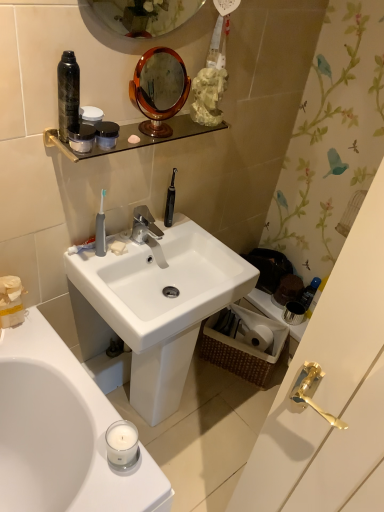
Measure the distance between black matte spray can at upper left and camera.

black matte spray can at upper left and camera are 3.39 feet apart.

Identify the location of matte black jar at upper center, the first mouthwash from the top. This screenshot has width=384, height=512. (106, 134).

You are a GUI agent. You are given a task and a screenshot of the screen. Output one action in this format:
    pyautogui.click(x=<x>, y=<y>)
    Task: Click on the silver metallic faucet at center
    
    Given the screenshot: What is the action you would take?
    pyautogui.click(x=144, y=225)

The height and width of the screenshot is (512, 384). Identify the location of shiny brown mirror at upper center. (159, 89).

Identify the location of black matte spray can at upper left. This screenshot has height=512, width=384. (68, 94).

From the image's perspective, between shiny brown mirror at upper center and white glossy sink at center, who is located below?

white glossy sink at center is shown below in the image.

Can you see shiny brown mirror at upper center touching white glossy sink at center?

shiny brown mirror at upper center and white glossy sink at center are clearly separated.

In the scene shown: Does shiny brown mirror at upper center come in front of white glossy sink at center?

That is True.

Could you tell me if silver metallic faucet at center is facing blue glossy bottle at right, placed as the third mouthwash when sorted from top to bottom?

No.

From the image's perspective, between silver metallic faucet at center and blue glossy bottle at right, placed as the third mouthwash when sorted from top to bottom, which one is located above?

silver metallic faucet at center is shown above in the image.

Which object is positioned more to the right, silver metallic faucet at center or blue glossy bottle at right, marked as the 1th mouthwash in a back-to-front arrangement?

blue glossy bottle at right, marked as the 1th mouthwash in a back-to-front arrangement.

Which is behind, point (134, 229) or point (305, 298)?

The point (305, 298) is farther from the camera.

Considering the positions of objects woven brown picnic basket at lower right and silver metallic faucet at center in the image provided, who is more to the left, woven brown picnic basket at lower right or silver metallic faucet at center?

Positioned to the left is silver metallic faucet at center.

Consider the image. Is woven brown picnic basket at lower right directly adjacent to silver metallic faucet at center?

There is a gap between woven brown picnic basket at lower right and silver metallic faucet at center.

Based on the photo, is woven brown picnic basket at lower right not inside silver metallic faucet at center?

Yes, woven brown picnic basket at lower right is located beyond the bounds of silver metallic faucet at center.

Can you tell me how much woven brown picnic basket at lower right and silver metallic faucet at center differ in facing direction?

woven brown picnic basket at lower right and silver metallic faucet at center are facing 65.9 degrees away from each other.

From the image's perspective, relative to matte black jar at upper center, which is the first mouthwash from front to back, is white matte toilet paper at lower right above or below?

Clearly, from the image's perspective, white matte toilet paper at lower right is below matte black jar at upper center, which is the first mouthwash from front to back.

From the picture: Is the position of white matte toilet paper at lower right more distant than that of matte black jar at upper center, arranged as the 2th mouthwash when ordered from the bottom?

Yes, white matte toilet paper at lower right is behind matte black jar at upper center, arranged as the 2th mouthwash when ordered from the bottom.

Is white matte toilet paper at lower right oriented towards matte black jar at upper center, which appears as the second mouthwash when viewed from the top?

No, white matte toilet paper at lower right is not aimed at matte black jar at upper center, which appears as the second mouthwash when viewed from the top.

Which mouthwash is the 2nd one when counting from the front of the white matte toilet paper at lower right? Please provide its 2D coordinates.

[(81, 137)]

Which is in front, black matte spray can at upper left or matte black jar at upper center, which appears as the second mouthwash when viewed from the top?

black matte spray can at upper left is in front.

Could you measure the distance between black matte spray can at upper left and matte black jar at upper center, which is the first mouthwash from front to back?

black matte spray can at upper left and matte black jar at upper center, which is the first mouthwash from front to back, are 2.51 inches apart from each other.

Considering the sizes of objects black matte spray can at upper left and matte black jar at upper center, which ranks as the 3th mouthwash in right-to-left order, in the image provided, who is taller, black matte spray can at upper left or matte black jar at upper center, which ranks as the 3th mouthwash in right-to-left order,?

black matte spray can at upper left.

Considering the relative positions of black matte spray can at upper left and matte black jar at upper center, which appears as the second mouthwash when viewed from the top, in the image provided, is black matte spray can at upper left to the left of matte black jar at upper center, which appears as the second mouthwash when viewed from the top, from the viewer's perspective?

Yes, black matte spray can at upper left is to the left of matte black jar at upper center, which appears as the second mouthwash when viewed from the top.

Is woven brown picnic basket at lower right in contact with shiny brown mirror at upper center?

No, woven brown picnic basket at lower right is not with shiny brown mirror at upper center.

Which is nearer, [229,366] or [170,134]?

Point [229,366] is farther from the camera than point [170,134].

From a real-world perspective, is woven brown picnic basket at lower right positioned above or below shiny brown mirror at upper center?

From a real-world perspective, woven brown picnic basket at lower right is physically below shiny brown mirror at upper center.

Is woven brown picnic basket at lower right aimed at shiny brown mirror at upper center?

No.

I want to click on picnic basket that is under the metallic silver cup at right (from a real-world perspective), so point(244,343).

Can you confirm if woven brown picnic basket at lower right is thinner than metallic silver cup at right?

In fact, woven brown picnic basket at lower right might be wider than metallic silver cup at right.

Considering the sizes of objects woven brown picnic basket at lower right and metallic silver cup at right in the image provided, who is shorter, woven brown picnic basket at lower right or metallic silver cup at right?

With less height is metallic silver cup at right.

The image size is (384, 512). I want to click on mirror in front of the white glossy sink at center, so click(x=159, y=89).

Locate an element on the screen. The width and height of the screenshot is (384, 512). mouthwash that appears behind the silver metallic faucet at center is located at coordinates (310, 292).

When comparing their distances from black matte spray can at upper left, does woven brown picnic basket at lower right or white glossy sink at center seem closer?

white glossy sink at center is closer to black matte spray can at upper left.

Looking at this image, considering their positions, is shiny brown mirror at upper center positioned closer to white matte toilet paper at lower right than blue glossy bottle at right, the 3th mouthwash positioned from the front?

blue glossy bottle at right, the 3th mouthwash positioned from the front, lies closer to white matte toilet paper at lower right than the other object.

Considering their positions, is matte black jar at upper center, the third mouthwash viewed from the back, positioned further to matte black jar at upper center, the 3th mouthwash when ordered from bottom to top, than shiny brown mirror at upper center?

The object further to matte black jar at upper center, the 3th mouthwash when ordered from bottom to top, is shiny brown mirror at upper center.

Looking at the image, which one is located closer to blue glossy bottle at right, arranged as the third mouthwash when viewed from the left, white matte toilet paper at lower right or matte black jar at upper center, the third mouthwash viewed from the back?

white matte toilet paper at lower right.

From the image, which object appears to be farther from matte black jar at upper center, the 3th mouthwash when ordered from bottom to top, white matte toilet paper at lower right or clear glass shelf at upper center?

white matte toilet paper at lower right lies further to matte black jar at upper center, the 3th mouthwash when ordered from bottom to top, than the other object.

From the image, which object appears to be farther from clear glass shelf at upper center, woven brown picnic basket at lower right or metallic silver cup at right?

The object further to clear glass shelf at upper center is metallic silver cup at right.

When comparing their distances from blue glossy bottle at right, placed as the third mouthwash when sorted from top to bottom, does metallic silver cup at right or matte black jar at upper center, marked as the 2th mouthwash in a right-to-left arrangement, seem further?

Among the two, matte black jar at upper center, marked as the 2th mouthwash in a right-to-left arrangement, is located further to blue glossy bottle at right, placed as the third mouthwash when sorted from top to bottom.

When comparing their distances from woven brown picnic basket at lower right, does shiny brown mirror at upper center or blue glossy bottle at right, arranged as the third mouthwash when viewed from the left, seem closer?

blue glossy bottle at right, arranged as the third mouthwash when viewed from the left, is closer to woven brown picnic basket at lower right.

What are the coordinates of `sink between clear glass shelf at upper center and metallic silver cup at right in the front-back direction` in the screenshot? It's located at (155, 305).

Identify the location of tap between white glossy sink at center and white matte toilet paper at lower right in the front-back direction. (144, 225).

The image size is (384, 512). In order to click on tap positioned between clear glass shelf at upper center and white matte toilet paper at lower right from near to far in this screenshot , I will do `click(144, 225)`.

Find the location of a particular element. This screenshot has height=512, width=384. sink between matte black jar at upper center, marked as the 2th mouthwash in a right-to-left arrangement, and blue glossy bottle at right, the 3th mouthwash positioned from the front, from front to back is located at coordinates 155,305.